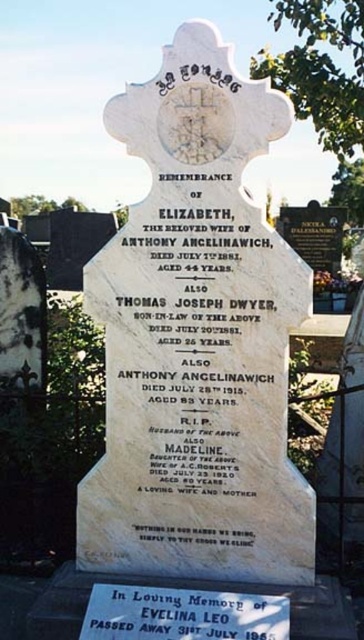
You are standing near a cemetery and want to place a bouquet of flowers at the base of the white marble gravestone at center. If your arm reaches 6 feet, can you reach the gravestone without moving closer?

The white marble gravestone at center is 8.04 feet away from viewer. Since your arm reaches only 6 feet, you cannot reach the gravestone without moving closer.

You are standing at the point with coordinates point (175, 637) in the cemetery. You want to walk to the point with coordinates point (212, 369). Will you have to walk around any objects in the scene to reach your destination?

Yes, you will have to walk around the tombstone in the scene because point (212, 369) is behind point (175, 637), meaning the tombstone is blocking the direct path between them.